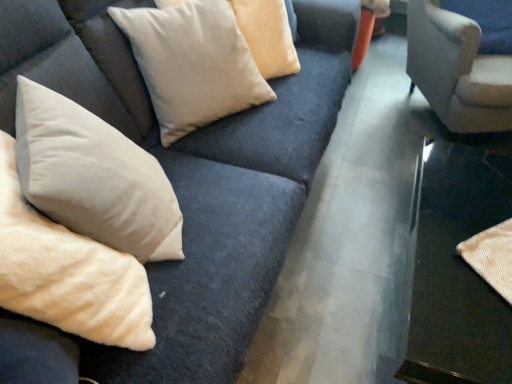
Where is `metallic silver table at lower right`? This screenshot has height=384, width=512. metallic silver table at lower right is located at coordinates (458, 263).

Describe the element at coordinates (193, 64) in the screenshot. This screenshot has height=384, width=512. I see `suede-like beige pillow at upper center, which ranks as the second pillow in front-to-back order` at that location.

Measure the distance between white soft pillow at lower left, the 1th pillow from the front, and camera.

The depth of white soft pillow at lower left, the 1th pillow from the front, is 28.04 inches.

The image size is (512, 384). I want to click on velvet beige pillows at upper left, so click(x=183, y=186).

Identify the location of metallic silver table at lower right. This screenshot has width=512, height=384. (458, 263).

Is white soft pillow at lower left, the second pillow viewed from the back, to the left of suede-like beige pillow at upper center, which ranks as the second pillow in front-to-back order, from the viewer's perspective?

Yes.

Is white soft pillow at lower left, the second pillow viewed from the back, beside suede-like beige pillow at upper center, the first pillow viewed from the back?

They are not placed beside each other.

Would you say white soft pillow at lower left, the second pillow viewed from the back, is inside or outside suede-like beige pillow at upper center, which ranks as the second pillow in front-to-back order?

The correct answer is: outside.

Is suede gray chair at upper right oriented towards velvet beige pillows at upper left?

No, suede gray chair at upper right is not turned towards velvet beige pillows at upper left.

Is suede gray chair at upper right far away from velvet beige pillows at upper left?

No, suede gray chair at upper right is in close proximity to velvet beige pillows at upper left.

The height and width of the screenshot is (384, 512). In order to click on chair below the velvet beige pillows at upper left (from a real-world perspective) in this screenshot , I will do `click(457, 70)`.

Does point (130, 114) appear closer or farther from the camera than point (215, 0)?

Point (130, 114).

Can you confirm if velvet beige pillows at upper left is wider than suede-like beige pillow at upper center, the first pillow viewed from the back?

Correct, the width of velvet beige pillows at upper left exceeds that of suede-like beige pillow at upper center, the first pillow viewed from the back.

Where is `pillow that is the 1st object above the velvet beige pillows at upper left (from a real-world perspective)`? This screenshot has width=512, height=384. pillow that is the 1st object above the velvet beige pillows at upper left (from a real-world perspective) is located at coordinates (193, 64).

From the image's perspective, is velvet beige pillows at upper left positioned above or below suede-like beige pillow at upper center, the first pillow viewed from the back?

Clearly, from the image's perspective, velvet beige pillows at upper left is below suede-like beige pillow at upper center, the first pillow viewed from the back.

Which object is closer to the camera, velvet beige pillows at upper left or metallic silver table at lower right?

velvet beige pillows at upper left is closer to the camera.

This screenshot has height=384, width=512. Find the location of `studio couch positioned vertically above the metallic silver table at lower right (from a real-world perspective)`. studio couch positioned vertically above the metallic silver table at lower right (from a real-world perspective) is located at coordinates (183, 186).

Considering the sizes of velvet beige pillows at upper left and metallic silver table at lower right in the image, is velvet beige pillows at upper left taller or shorter than metallic silver table at lower right?

Considering their sizes, velvet beige pillows at upper left has more height than metallic silver table at lower right.

From the image's perspective, is velvet beige pillows at upper left positioned above or below metallic silver table at lower right?

From the image's perspective, velvet beige pillows at upper left appears above metallic silver table at lower right.

Is suede gray chair at upper right facing towards metallic silver table at lower right?

Yes, suede gray chair at upper right is oriented towards metallic silver table at lower right.

Can you confirm if suede gray chair at upper right is wider than metallic silver table at lower right?

No.

Who is more distant, suede gray chair at upper right or metallic silver table at lower right?

Positioned behind is suede gray chair at upper right.

From the image's perspective, is suede gray chair at upper right on top of metallic silver table at lower right?

Yes.

Could suede gray chair at upper right be considered to be inside velvet beige pillows at upper left?

No.

Is velvet beige pillows at upper left oriented towards suede gray chair at upper right?

Yes, velvet beige pillows at upper left is turned towards suede gray chair at upper right.

Visually, is velvet beige pillows at upper left positioned to the left or to the right of suede gray chair at upper right?

From the image, it's evident that velvet beige pillows at upper left is to the left of suede gray chair at upper right.

Does velvet beige pillows at upper left have a greater width compared to suede gray chair at upper right?

Yes, velvet beige pillows at upper left is wider than suede gray chair at upper right.

Does suede gray chair at upper right appear on the right side of suede-like beige pillow at upper center, which ranks as the second pillow in front-to-back order?

Yes, suede gray chair at upper right is to the right of suede-like beige pillow at upper center, which ranks as the second pillow in front-to-back order.

Which is behind, suede gray chair at upper right or suede-like beige pillow at upper center, which ranks as the second pillow in front-to-back order?

Positioned behind is suede gray chair at upper right.

Between point (469, 128) and point (158, 60), which one is positioned in front?

The point (158, 60) is closer to the camera.

Consider the image. Is suede gray chair at upper right bigger or smaller than suede-like beige pillow at upper center, which ranks as the second pillow in front-to-back order?

In the image, suede gray chair at upper right appears to be smaller than suede-like beige pillow at upper center, which ranks as the second pillow in front-to-back order.

This screenshot has height=384, width=512. Identify the location of pillow on the right side of white soft pillow at lower left, the second pillow viewed from the back. (193, 64).

You are a GUI agent. You are given a task and a screenshot of the screen. Output one action in this format:
    pyautogui.click(x=<x>, y=<y>)
    Task: Click on the chair above the velvet beige pillows at upper left (from the image's perspective)
    The image size is (512, 384).
    Given the screenshot: What is the action you would take?
    pyautogui.click(x=457, y=70)

Based on their spatial positions, is metallic silver table at lower right or white soft pillow at lower left, the second pillow viewed from the back, closer to suede-like beige pillow at upper center, which ranks as the second pillow in front-to-back order?

white soft pillow at lower left, the second pillow viewed from the back.

Estimate the real-world distances between objects in this image. Which object is further from suede-like beige pillow at upper center, which ranks as the second pillow in front-to-back order, metallic silver table at lower right or velvet beige pillows at upper left?

metallic silver table at lower right is further to suede-like beige pillow at upper center, which ranks as the second pillow in front-to-back order.

Considering their positions, is white soft pillow at lower left, the second pillow viewed from the back, positioned further to metallic silver table at lower right than velvet beige pillows at upper left?

Among the two, white soft pillow at lower left, the second pillow viewed from the back, is located further to metallic silver table at lower right.

Based on their spatial positions, is white soft pillow at lower left, the second pillow viewed from the back, or velvet beige pillows at upper left further from suede gray chair at upper right?

Based on the image, white soft pillow at lower left, the second pillow viewed from the back, appears to be further to suede gray chair at upper right.

From the image, which object appears to be farther from metallic silver table at lower right, velvet beige pillows at upper left or suede gray chair at upper right?

Based on the image, velvet beige pillows at upper left appears to be further to metallic silver table at lower right.

Based on their spatial positions, is white soft pillow at lower left, the second pillow viewed from the back, or metallic silver table at lower right closer to suede gray chair at upper right?

The object closer to suede gray chair at upper right is metallic silver table at lower right.

From the image, which object appears to be farther from white soft pillow at lower left, the 1th pillow from the front, velvet beige pillows at upper left or suede-like beige pillow at upper center, the first pillow viewed from the back?

Among the two, suede-like beige pillow at upper center, the first pillow viewed from the back, is located further to white soft pillow at lower left, the 1th pillow from the front.

Based on their spatial positions, is metallic silver table at lower right or suede gray chair at upper right further from white soft pillow at lower left, the 1th pillow from the front?

Among the two, suede gray chair at upper right is located further to white soft pillow at lower left, the 1th pillow from the front.

Where is `pillow between velvet beige pillows at upper left and suede gray chair at upper right from left to right`? pillow between velvet beige pillows at upper left and suede gray chair at upper right from left to right is located at coordinates (193, 64).

Where is `table situated between velvet beige pillows at upper left and suede gray chair at upper right from left to right`? This screenshot has width=512, height=384. table situated between velvet beige pillows at upper left and suede gray chair at upper right from left to right is located at coordinates (458, 263).

Where is `pillow located between white soft pillow at lower left, the 1th pillow from the front, and suede gray chair at upper right in the left-right direction`? pillow located between white soft pillow at lower left, the 1th pillow from the front, and suede gray chair at upper right in the left-right direction is located at coordinates (193, 64).

The image size is (512, 384). I want to click on studio couch between white soft pillow at lower left, the 1th pillow from the front, and metallic silver table at lower right, in the horizontal direction, so click(183, 186).